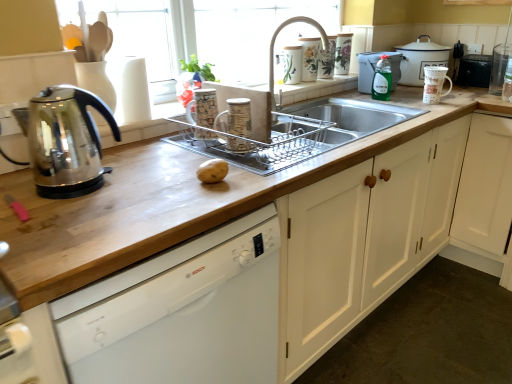
Question: Looking at the image, does white glossy dishwasher at center seem bigger or smaller compared to clear glass at upper right, the 1th appliance positioned from the right?

Choices:
 (A) small
 (B) big

Answer: (B)

Question: In the image, is white glossy dishwasher at center on the left side or the right side of clear glass at upper right, the 1th appliance positioned from the right?

Choices:
 (A) right
 (B) left

Answer: (B)

Question: Estimate the real-world distances between objects in this image. Which object is farther from the clear glass at upper right, the 7th appliance in the left-to-right sequence?

Choices:
 (A) matte ceramic mugs at center, the 1th appliance from the left
 (B) porcelain floral mug at upper center, the fifth appliance when ordered from right to left
 (C) brown matte potato at center
 (D) black plastic trash can at upper right, which ranks as the 2th appliance in right-to-left order
 (E) porcelain floral vase at upper center, which is the 4th appliance in left-to-right order

Answer: (C)

Question: Considering the real-world distances, which object is closest to the white enamel pot at upper right, positioned as the first kitchen appliance in right-to-left order?

Choices:
 (A) silver metallic faucet at upper center
 (B) matte ceramic mug at upper center, which is the 6th appliance from right to left
 (C) porcelain floral vase at upper center, which is the 4th appliance in left-to-right order
 (D) transparent glass window screen at upper center
 (E) white glossy dishwasher at center

Answer: (A)